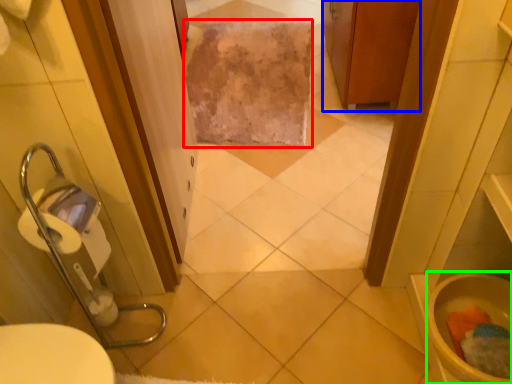
Question: Which object is the closest to the bath towel (highlighted by a red box)? Choose among these: cabinetry (highlighted by a blue box) or toilet bowl (highlighted by a green box).

Choices:
 (A) cabinetry
 (B) toilet bowl

Answer: (A)